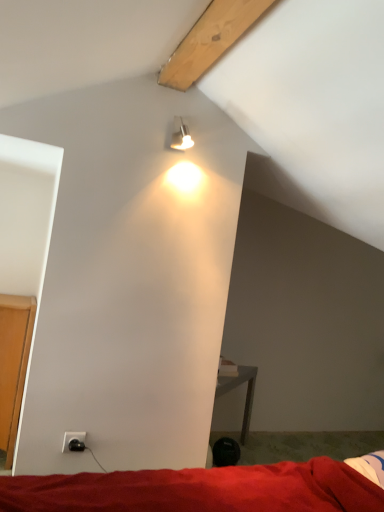
Question: From a real-world perspective, is red fabric bed at lower center beneath black plastic power outlet at lower left?

Choices:
 (A) yes
 (B) no

Answer: (A)

Question: Is red fabric bed at lower center shorter than black plastic power outlet at lower left?

Choices:
 (A) yes
 (B) no

Answer: (B)

Question: Is black plastic power outlet at lower left at the back of red fabric bed at lower center?

Choices:
 (A) yes
 (B) no

Answer: (B)

Question: Is red fabric bed at lower center surrounding black plastic power outlet at lower left?

Choices:
 (A) no
 (B) yes

Answer: (A)

Question: From the image's perspective, is red fabric bed at lower center below black plastic power outlet at lower left?

Choices:
 (A) yes
 (B) no

Answer: (A)

Question: Is black plastic power outlet at lower left taller or shorter than red fabric bed at lower center?

Choices:
 (A) short
 (B) tall

Answer: (A)

Question: In terms of size, does black plastic power outlet at lower left appear bigger or smaller than red fabric bed at lower center?

Choices:
 (A) small
 (B) big

Answer: (A)

Question: Considering the positions of black plastic power outlet at lower left and red fabric bed at lower center in the image, is black plastic power outlet at lower left wider or thinner than red fabric bed at lower center?

Choices:
 (A) wide
 (B) thin

Answer: (B)

Question: In the image, is black plastic power outlet at lower left positioned in front of or behind red fabric bed at lower center?

Choices:
 (A) behind
 (B) front

Answer: (A)

Question: From the image's perspective, is metallic silver spotlight at upper center above or below red fabric bed at lower center?

Choices:
 (A) below
 (B) above

Answer: (B)

Question: In terms of width, does metallic silver spotlight at upper center look wider or thinner when compared to red fabric bed at lower center?

Choices:
 (A) wide
 (B) thin

Answer: (B)

Question: Considering the positions of point (175, 140) and point (327, 488), is point (175, 140) closer or farther from the camera than point (327, 488)?

Choices:
 (A) closer
 (B) farther

Answer: (B)

Question: Is metallic silver spotlight at upper center inside the boundaries of red fabric bed at lower center, or outside?

Choices:
 (A) inside
 (B) outside

Answer: (B)

Question: In the image, is red fabric bed at lower center on the left side or the right side of black plastic power outlet at lower left?

Choices:
 (A) left
 (B) right

Answer: (B)

Question: Is red fabric bed at lower center in front of or behind black plastic power outlet at lower left in the image?

Choices:
 (A) behind
 (B) front

Answer: (B)